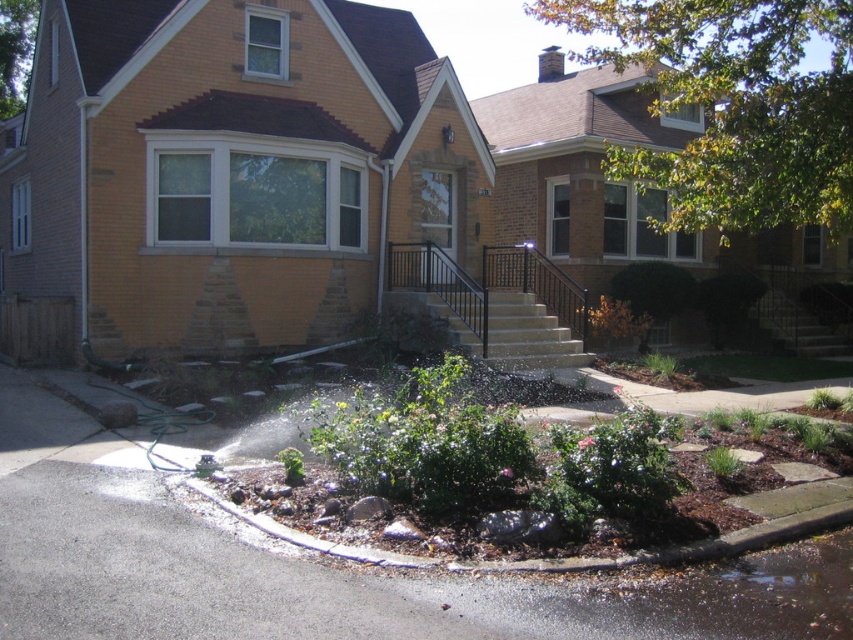
Between light beige concrete stairs at center and dark brown wooden stairs at center, which one has less height?

light beige concrete stairs at center

Is light beige concrete stairs at center smaller than dark brown wooden stairs at center?

Yes.

Is point (502, 342) positioned before point (793, 301)?

Yes, point (502, 342) is in front of point (793, 301).

This screenshot has height=640, width=853. In order to click on light beige concrete stairs at center in this screenshot , I will do `click(527, 336)`.